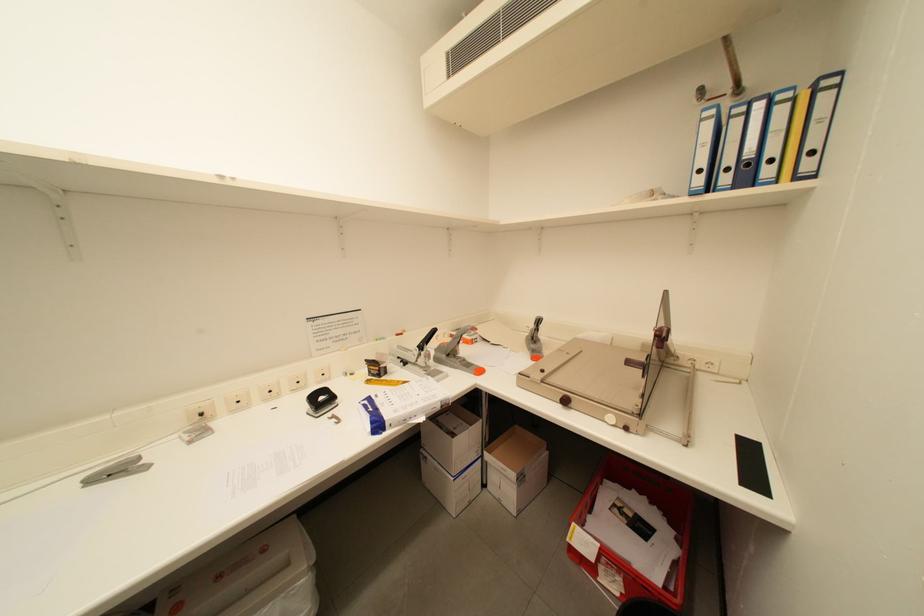
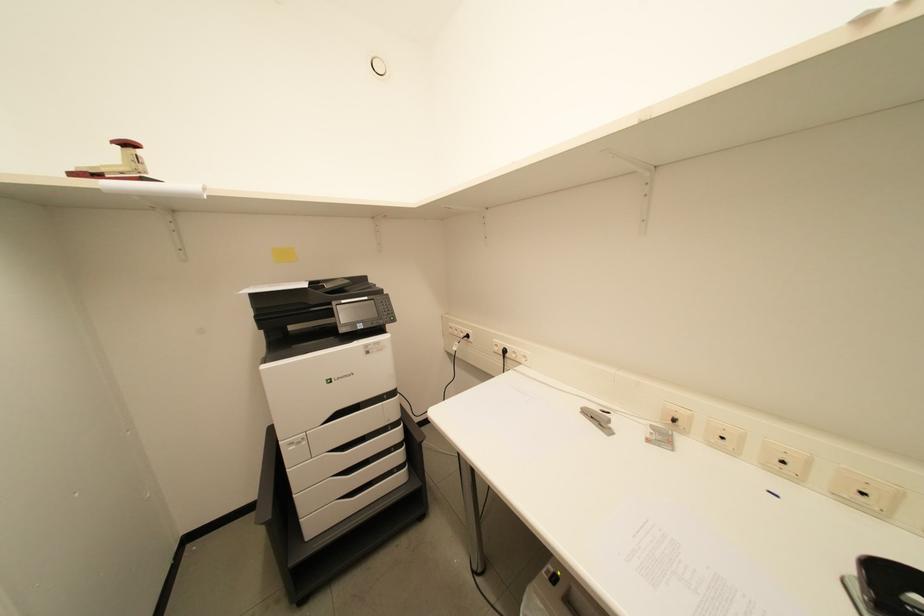
Based on the continuous images, in which direction is the camera rotating?

The rotation direction of the camera is left-down.